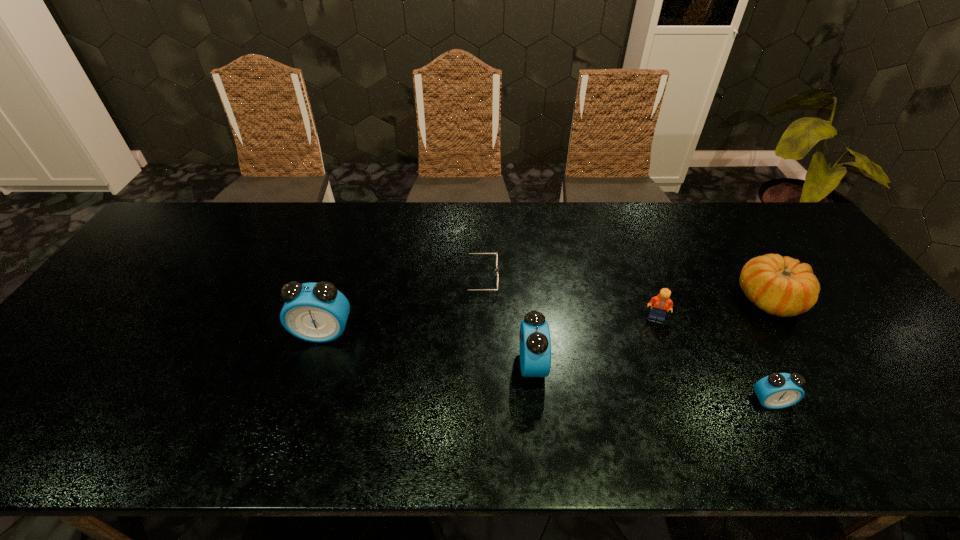
Given the evenly spaced alarm clocks in the image, where should an extra alarm clock be added on the left to preserve the spacing? Please point to a vacant space. Please provide its 2D coordinates. Your answer should be formatted as a tuple, i.e. [(x, y)], where the tuple contains the x and y coordinates of a point satisfying the conditions above.

[(140, 305)]